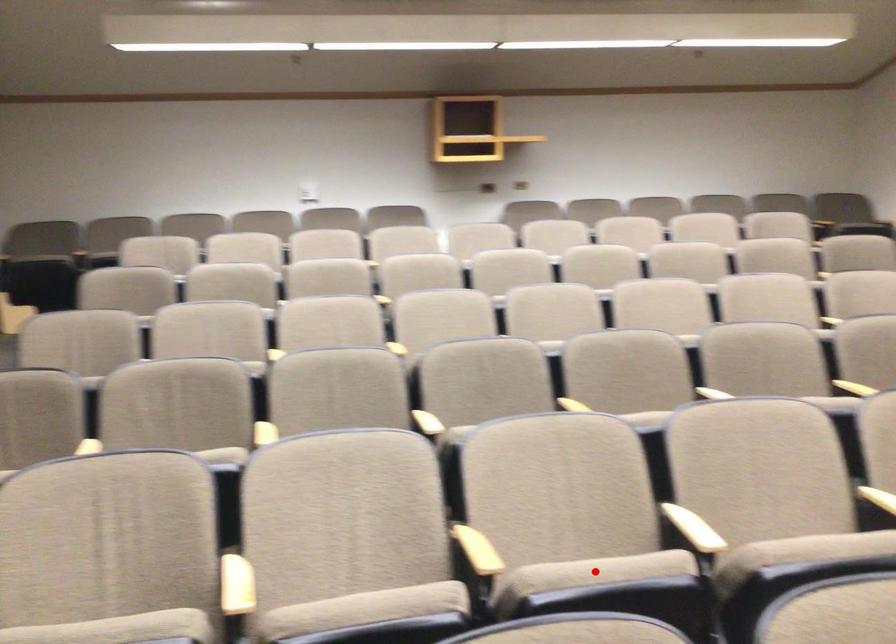
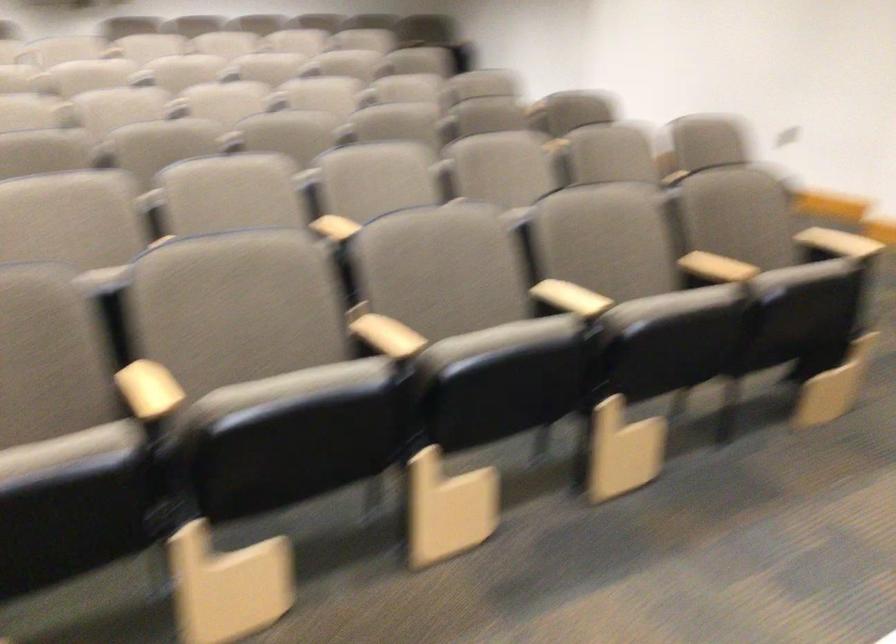
Question: I am providing you with two images of the same scene from different viewpoints. A red point is marked on the first image. Can you still see the location of the red point in image 2?

Choices:
 (A) Yes
 (B) No

Answer: (B)